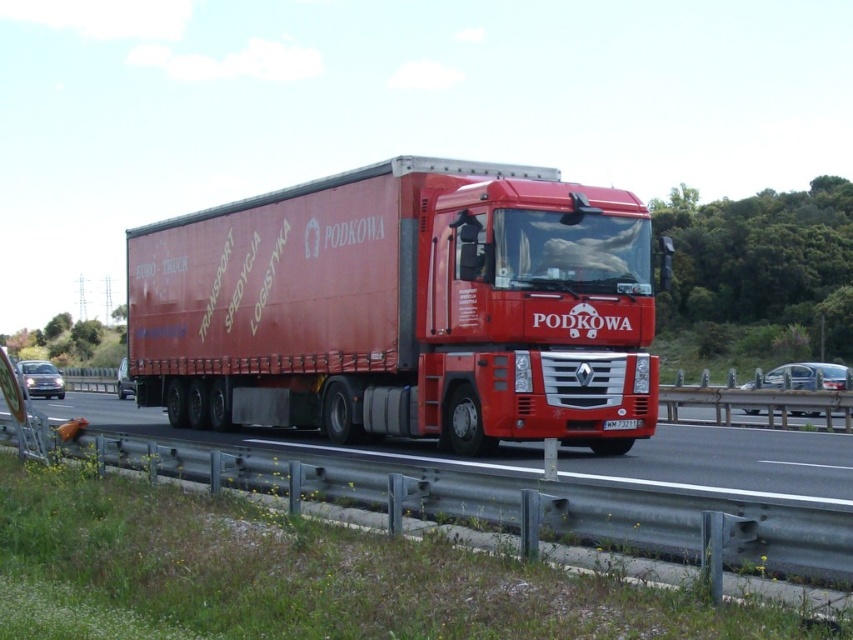
You are a driver who just noticed the white plastic license plate at center and the matte red trailer truck at center while driving on the highway. From your perspective, which object is positioned more to the right?

The matte red trailer truck at center is to the right of the white plastic license plate at center, so the matte red trailer truck at center is positioned more to the right.

You are a delivery driver who needs to pass under a low bridge. You see the matte red trailer truck at center and the metallic highway at lower left in your rearview mirror. Which object is more likely to hit the bridge first?

The matte red trailer truck at center is much taller than the metallic highway at lower left, so the truck is more likely to hit the bridge first if it passes under it.

You are a delivery driver who needs to park your matte red trailer truck at center in a parking spot that is 3 meters wide. Can you fit the truck into the spot without hitting the metallic highway at lower left?

The matte red trailer truck at center and metallic highway at lower left are 3.03 meters apart. Since the parking spot is 3 meters wide, the truck is slightly wider than the available space, so it might not fit without touching the metallic highway at lower left.